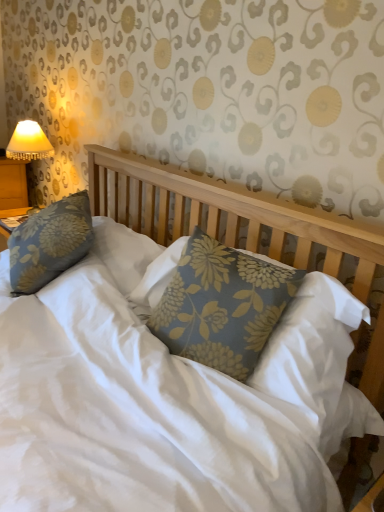
What do you see at coordinates (29, 142) in the screenshot? I see `matte cream lampshade at left` at bounding box center [29, 142].

Locate an element on the screen. matte cream lampshade at left is located at coordinates (29, 142).

Find the location of a particular element. matte cream lampshade at left is located at coordinates (29, 142).